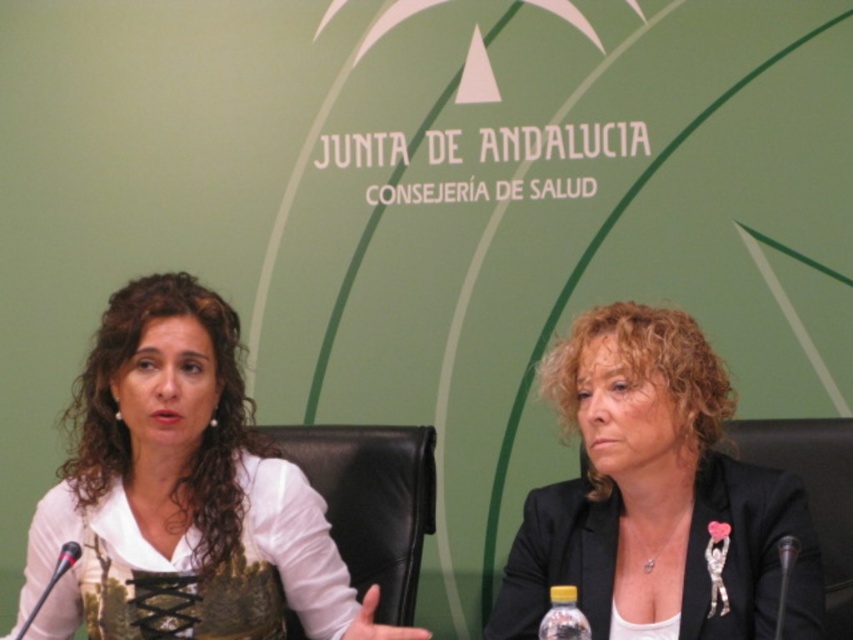
Is point (199, 552) more distant than point (361, 435)?

No, (199, 552) is in front of (361, 435).

Can you confirm if white lace blouse at center is wider than black leather chair at center?

Yes.

Does point (271, 504) come closer to viewer compared to point (398, 532)?

Yes, point (271, 504) is closer to viewer.

At what (x,y) coordinates should I click in order to perform the action: click on white lace blouse at center. Please return your answer as a coordinate pair (x, y). The height and width of the screenshot is (640, 853). Looking at the image, I should click on (183, 488).

Is black matte blazer at center taller than translucent plastic bottle at lower center?

Indeed, black matte blazer at center has a greater height compared to translucent plastic bottle at lower center.

Who is taller, black matte blazer at center or translucent plastic bottle at lower center?

black matte blazer at center

Does point (674, 614) come behind point (555, 586)?

Yes, it is.

This screenshot has height=640, width=853. What are the coordinates of `black matte blazer at center` in the screenshot? It's located at (654, 497).

Which is more to the right, black matte blazer at center or metallic silver microphone at lower left?

black matte blazer at center

The width and height of the screenshot is (853, 640). I want to click on black matte blazer at center, so coord(654,497).

Does point (659, 582) come farther from viewer compared to point (39, 600)?

Yes, point (659, 582) is behind point (39, 600).

The image size is (853, 640). What are the coordinates of `black matte blazer at center` in the screenshot? It's located at (654, 497).